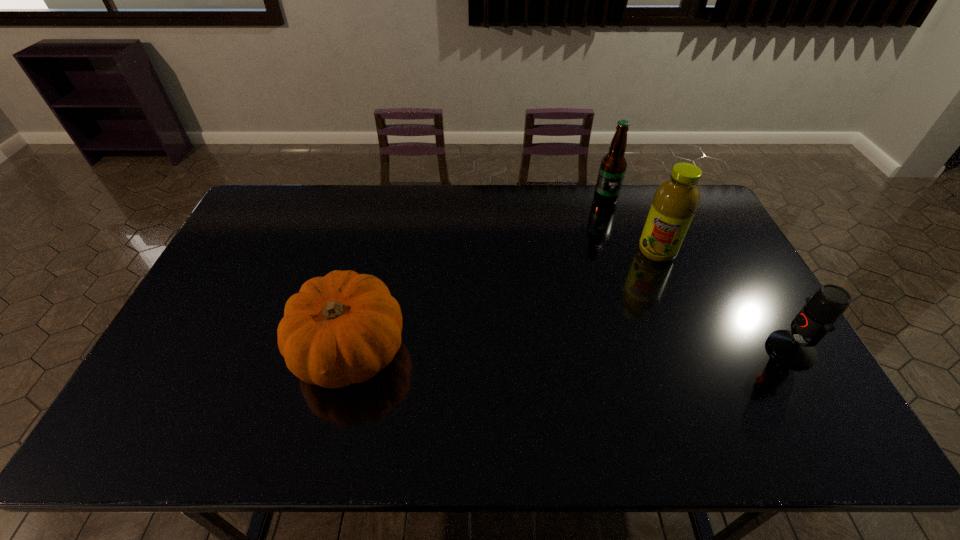
Locate an element on the screen. The height and width of the screenshot is (540, 960). vacant spot on the desktop that is between the leftmost object and the microphone and is positioned on the front label of the third nearest object is located at coordinates (608, 350).

The image size is (960, 540). What are the coordinates of `free space on the desktop that is between the pumpkin and the microphone and is positioned on the label of the farthest object` in the screenshot? It's located at [614, 350].